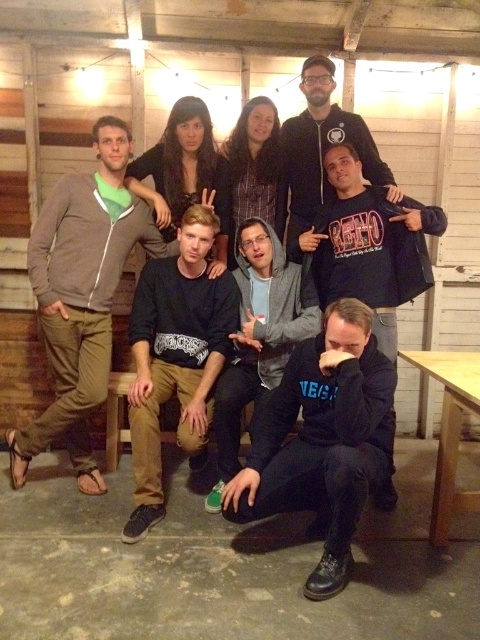
Question: Among these objects, which one is nearest to the camera?

Choices:
 (A) gray hoodie at center
 (B) matte black hoodie at upper center
 (C) black cotton sweater at center

Answer: (C)

Question: Is gray hoodie at center above matte black hoodie at upper center?

Choices:
 (A) no
 (B) yes

Answer: (A)

Question: Which point is closer to the camera?

Choices:
 (A) black matte hoodie at lower center
 (B) black cotton sweater at center
 (C) black hoodie at lower right

Answer: (A)

Question: Considering the real-world distances, which object is farthest from the gray hoodie at center?

Choices:
 (A) black hoodie at lower right
 (B) khaki cotton pants at left

Answer: (B)

Question: Does black matte hoodie at lower center have a smaller size compared to black hoodie at lower right?

Choices:
 (A) no
 (B) yes

Answer: (A)

Question: Does black matte hoodie at lower center have a larger size compared to gray hoodie at center?

Choices:
 (A) no
 (B) yes

Answer: (B)